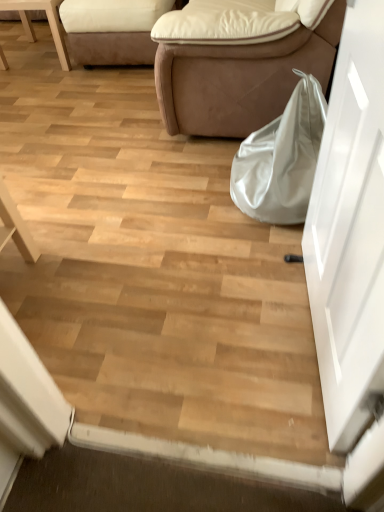
Identify the location of vacant space situated on the left part of brown leather couch at center, which is the first studio couch in right-to-left order. 77,121.